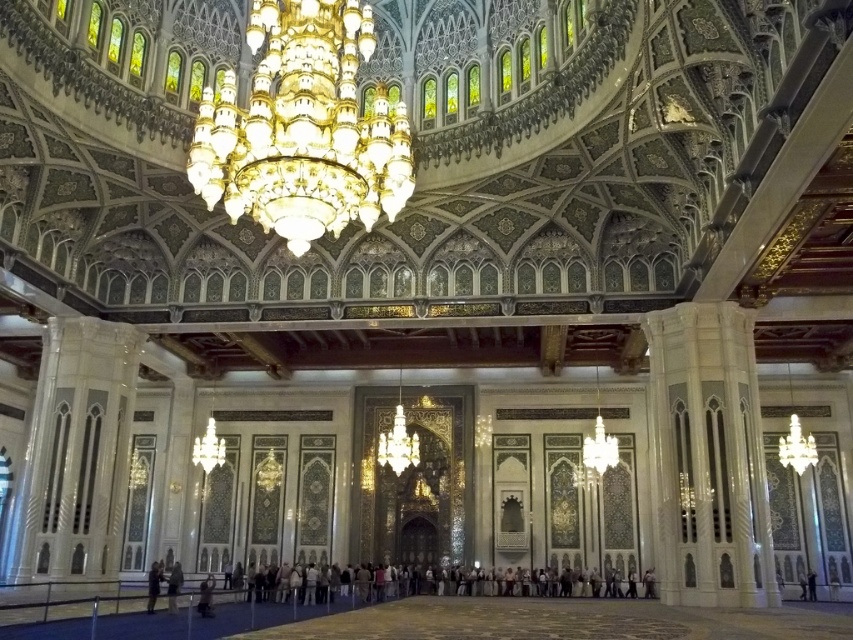
Is gold crystal chandelier at upper center above dark blue jeans at lower center?

Yes.

From the picture: Who is shorter, gold crystal chandelier at upper center or dark blue jeans at lower center?

dark blue jeans at lower center is shorter.

Locate an element on the screen. The height and width of the screenshot is (640, 853). gold crystal chandelier at upper center is located at coordinates (303, 128).